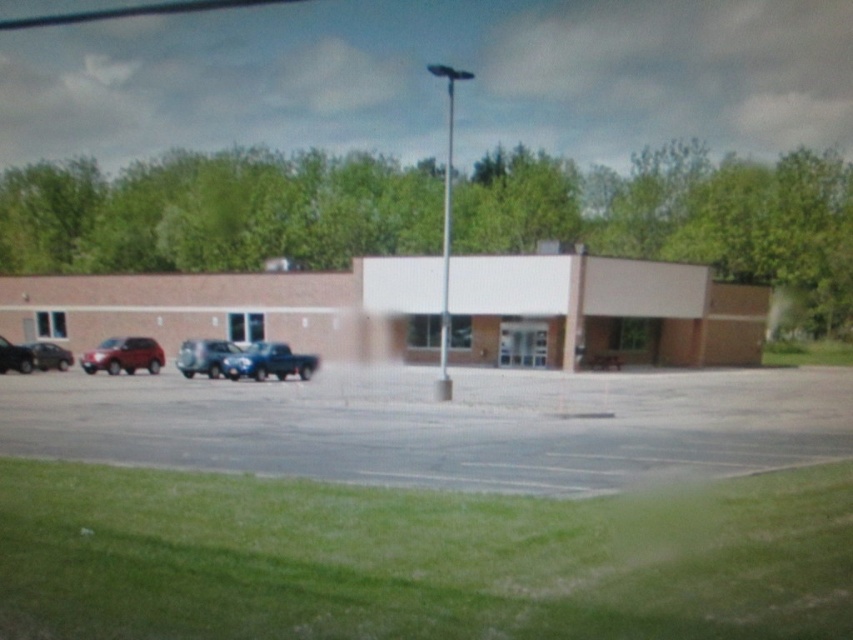
Can you confirm if matte red suv at lower left is positioned to the right of satin silver truck at center?

No, matte red suv at lower left is not to the right of satin silver truck at center.

Image resolution: width=853 pixels, height=640 pixels. Identify the location of matte red suv at lower left. (123, 355).

Is metallic blue truck at center taller than shiny silver sedan at left?

Correct, metallic blue truck at center is much taller as shiny silver sedan at left.

What do you see at coordinates (268, 362) in the screenshot? I see `metallic blue truck at center` at bounding box center [268, 362].

Who is more forward, (280, 368) or (44, 368)?

Point (280, 368) is more forward.

Find the location of `metallic blue truck at center`. metallic blue truck at center is located at coordinates (268, 362).

Does matte red suv at lower left have a smaller size compared to matte black car at left?

Correct, matte red suv at lower left occupies less space than matte black car at left.

Is point (115, 369) positioned before point (21, 356)?

No, it is behind (21, 356).

Where is `matte red suv at lower left`? matte red suv at lower left is located at coordinates pos(123,355).